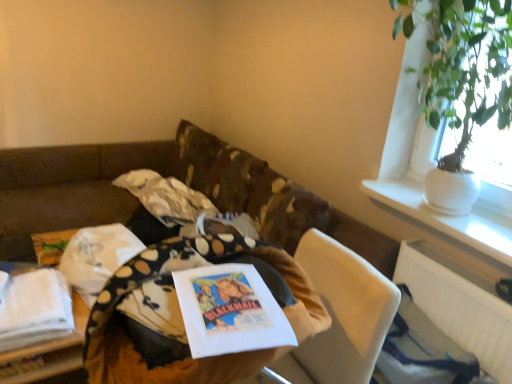
Question: From the image's perspective, is white ceramic vase at upper right beneath white fabric at lower left, the second table from the front?

Choices:
 (A) no
 (B) yes

Answer: (A)

Question: Is white ceramic vase at upper right smaller than white fabric at lower left, the second table from the front?

Choices:
 (A) no
 (B) yes

Answer: (B)

Question: Considering the relative positions of white ceramic vase at upper right and white fabric at lower left, arranged as the 1th table when viewed from the back, in the image provided, is white ceramic vase at upper right behind white fabric at lower left, arranged as the 1th table when viewed from the back,?

Choices:
 (A) no
 (B) yes

Answer: (A)

Question: Considering the relative sizes of white ceramic vase at upper right and white fabric at lower left, the second table from the front, in the image provided, is white ceramic vase at upper right wider than white fabric at lower left, the second table from the front,?

Choices:
 (A) yes
 (B) no

Answer: (A)

Question: Could you tell me if white ceramic vase at upper right is turned towards white fabric at lower left, the first table from the left?

Choices:
 (A) yes
 (B) no

Answer: (B)

Question: Is white ceramic vase at upper right surrounding white fabric at lower left, which is the 2th table from right to left?

Choices:
 (A) no
 (B) yes

Answer: (A)

Question: Is white fabric at lower left, the first table from the left, looking in the opposite direction of wooden table at center, which appears as the second table when viewed from the left?

Choices:
 (A) yes
 (B) no

Answer: (B)

Question: From the image's perspective, is white fabric at lower left, the second table from the front, on top of wooden table at center, arranged as the 1th table when viewed from the front?

Choices:
 (A) yes
 (B) no

Answer: (B)

Question: Can you confirm if white fabric at lower left, the first table from the left, is positioned to the right of wooden table at center, placed as the 1th table when sorted from right to left?

Choices:
 (A) no
 (B) yes

Answer: (A)

Question: From a real-world perspective, is white fabric at lower left, which is the 2th table from right to left, beneath wooden table at center, which appears as the second table when viewed from the left?

Choices:
 (A) yes
 (B) no

Answer: (A)

Question: Is white fabric at lower left, the second table from the front, outside wooden table at center, the second table positioned from the back?

Choices:
 (A) yes
 (B) no

Answer: (A)

Question: Is white fabric at lower left, the first table from the left, oriented towards wooden table at center, arranged as the 1th table when viewed from the front?

Choices:
 (A) no
 (B) yes

Answer: (A)

Question: Is the depth of green leafy plant in white pot at upper right less than that of wooden table at center, placed as the 1th table when sorted from right to left?

Choices:
 (A) yes
 (B) no

Answer: (B)